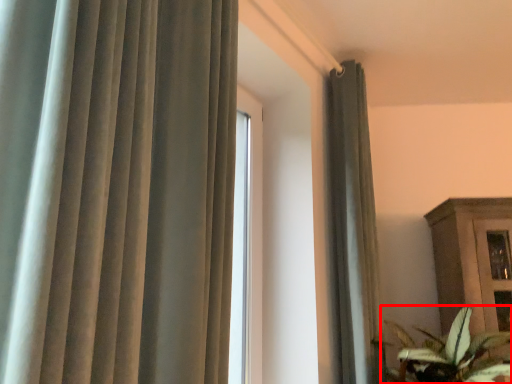
Question: From the image, what is the correct spatial relationship of houseplant (annotated by the red box) in relation to curtain?

Choices:
 (A) right
 (B) left

Answer: (A)